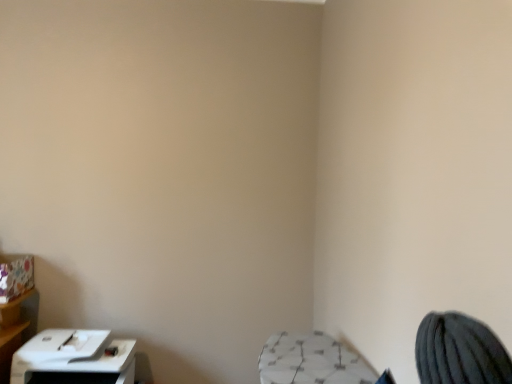
Question: Should I look upward or downward to see white plastic printer at lower left?

Choices:
 (A) up
 (B) down

Answer: (B)